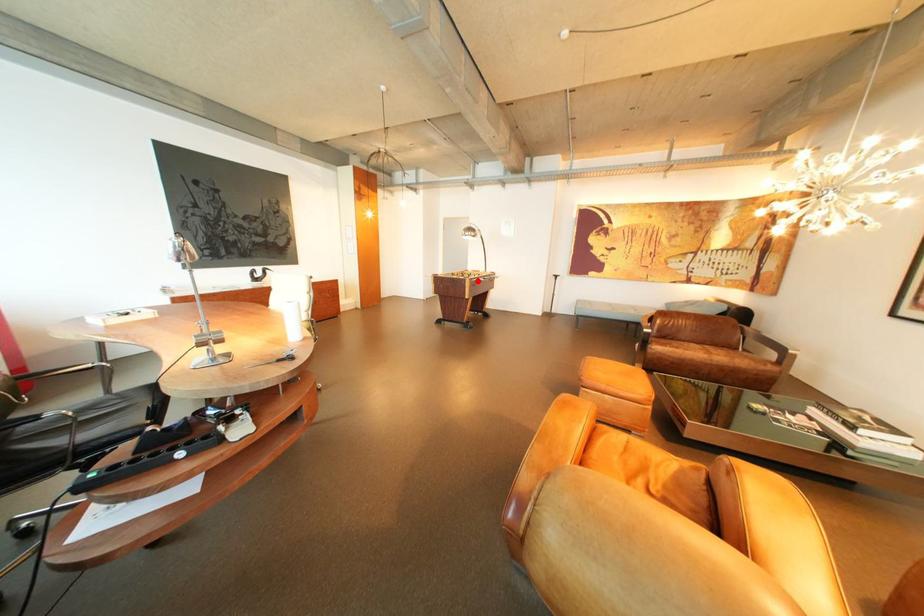
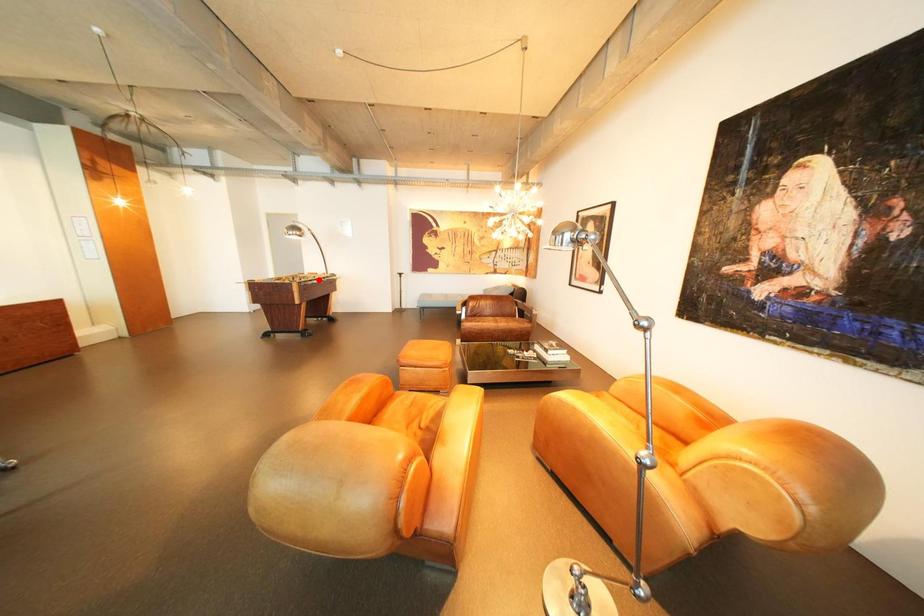
I am providing you with two images of the same scene from different viewpoints. A red point is marked on the first image and another point is marked on the second image. Is the red point in image1 aligned with the point shown in image2?

No